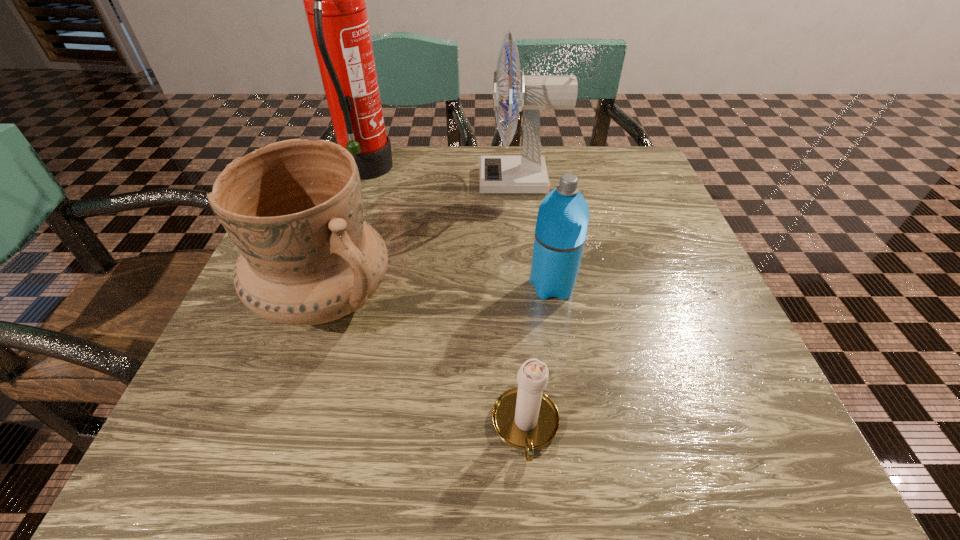
The width and height of the screenshot is (960, 540). Identify the location of vacant region that satisfies the following two spatial constraints: 1. on the front-facing side of the tallest object; 2. on the right side of the thermos bottle. (326, 286).

Where is `free spot that satisfies the following two spatial constraints: 1. on the front-facing side of the fan; 2. on the front side of the pottery`? free spot that satisfies the following two spatial constraints: 1. on the front-facing side of the fan; 2. on the front side of the pottery is located at coordinates (534, 298).